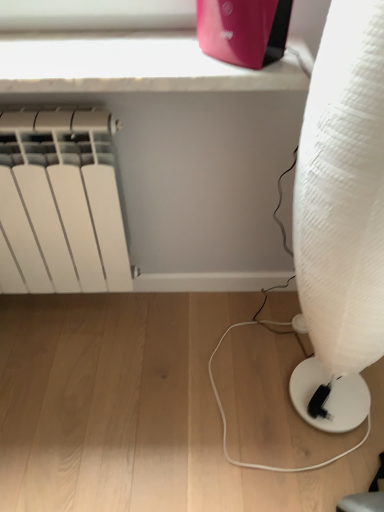
Question: Considering their positions, is white textured lamp at right located in front of or behind matte pink router at upper center?

Choices:
 (A) front
 (B) behind

Answer: (A)

Question: Is point (306, 276) positioned closer to the camera than point (254, 60)?

Choices:
 (A) closer
 (B) farther

Answer: (B)

Question: Which object is positioned farthest from the white matte radiator at left?

Choices:
 (A) matte pink router at upper center
 (B) white marble window sill at upper center
 (C) white textured lamp at right

Answer: (C)

Question: Which is nearer to the white matte radiator at left?

Choices:
 (A) matte pink router at upper center
 (B) white textured lamp at right
 (C) white marble window sill at upper center

Answer: (C)